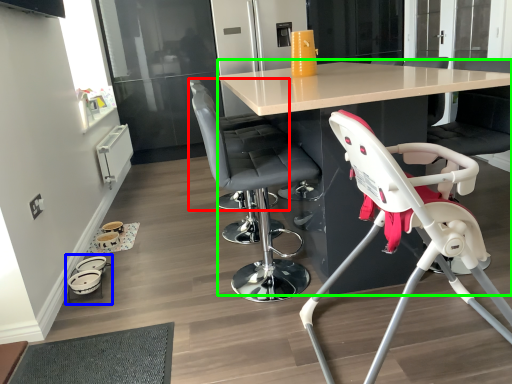
Question: Which object is the closest to the chair (highlighted by a red box)? Choose among these: baby carriage (highlighted by a blue box) or table (highlighted by a green box).

Choices:
 (A) baby carriage
 (B) table

Answer: (B)